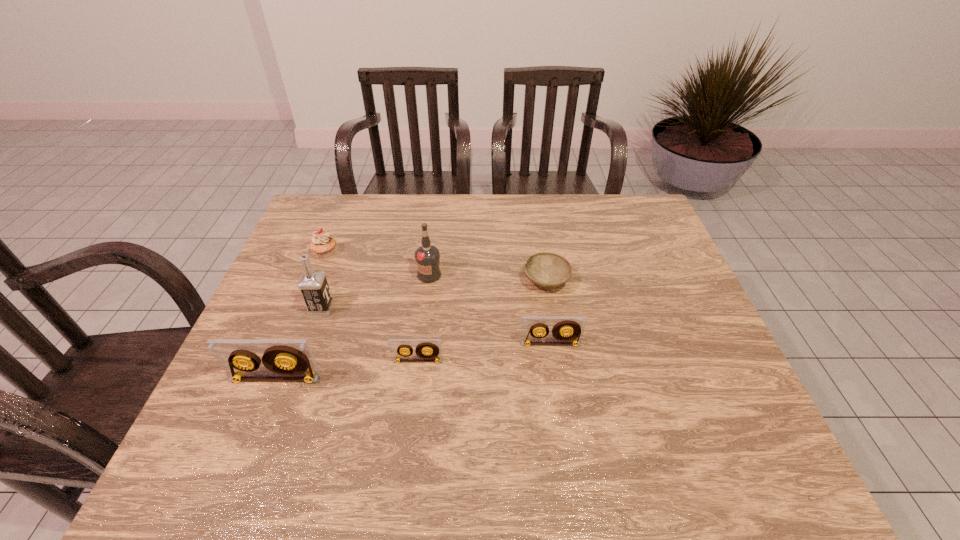
Identify the location of the nearest object. (283, 359).

This screenshot has height=540, width=960. In order to click on the leftmost videotape in this screenshot , I will do `click(283, 359)`.

Find the location of a particular element. This screenshot has height=540, width=960. the second videotape from right to left is located at coordinates (425, 349).

Find the location of a particular element. the shortest videotape is located at coordinates (425, 349).

What are the coordinates of `the third nearest object` in the screenshot? It's located at (567, 330).

What are the coordinates of `the second tallest videotape` in the screenshot? It's located at (567, 330).

Image resolution: width=960 pixels, height=540 pixels. Find the location of `the farthest object`. the farthest object is located at coordinates (322, 244).

Where is `the farther vodka`? The height and width of the screenshot is (540, 960). the farther vodka is located at coordinates (427, 257).

At what (x,y) coordinates should I click in order to perform the action: click on the fourth nearest object. Please return your answer as a coordinate pair (x, y). This screenshot has height=540, width=960. Looking at the image, I should click on (313, 285).

Find the location of a particular element. This screenshot has width=960, height=540. the left vodka is located at coordinates (313, 285).